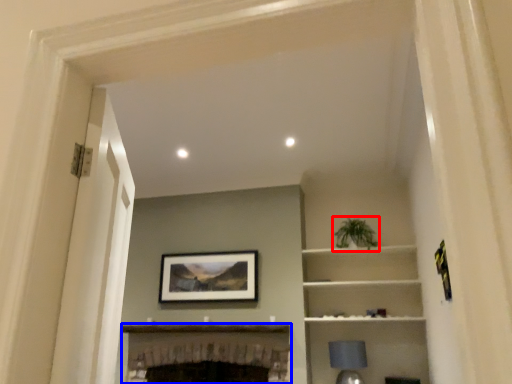
Question: Which object is closer to the camera taking this photo, plant (highlighted by a red box) or fireplace (highlighted by a blue box)?

Choices:
 (A) plant
 (B) fireplace

Answer: (B)